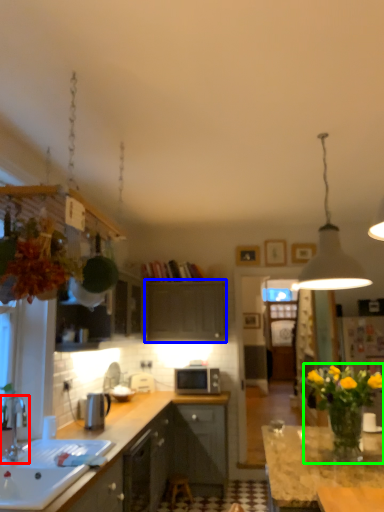
Question: Estimate the real-world distances between objects in this image. Which object is closer to tap (highlighted by a red box), cabinetry (highlighted by a blue box) or floral arrangement (highlighted by a green box)?

Choices:
 (A) cabinetry
 (B) floral arrangement

Answer: (B)